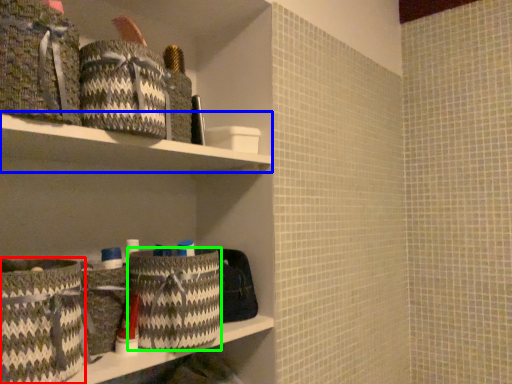
Question: Considering the real-world distances, which object is farthest from basket (highlighted by a red box)? cabinet (highlighted by a blue box) or laundry basket (highlighted by a green box)?

Choices:
 (A) cabinet
 (B) laundry basket

Answer: (A)